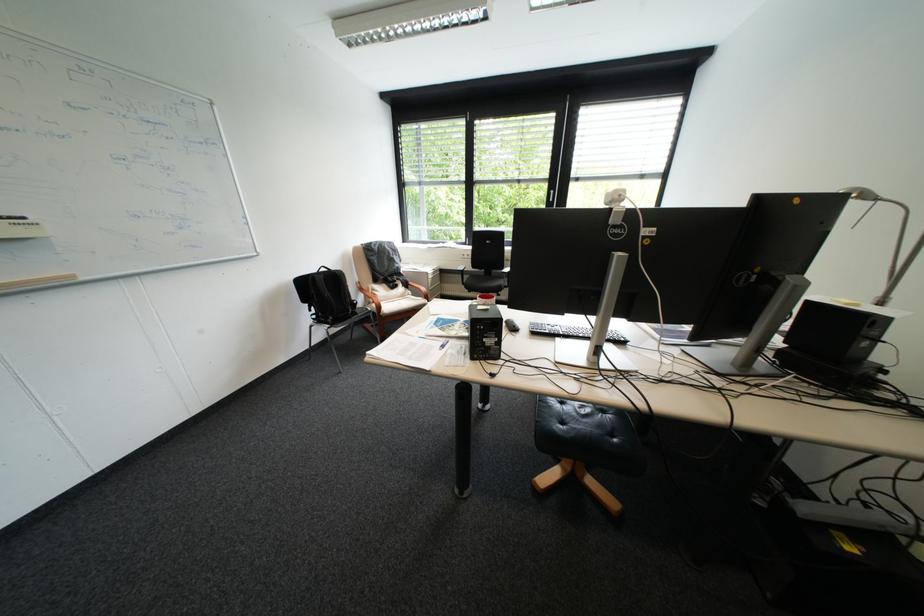
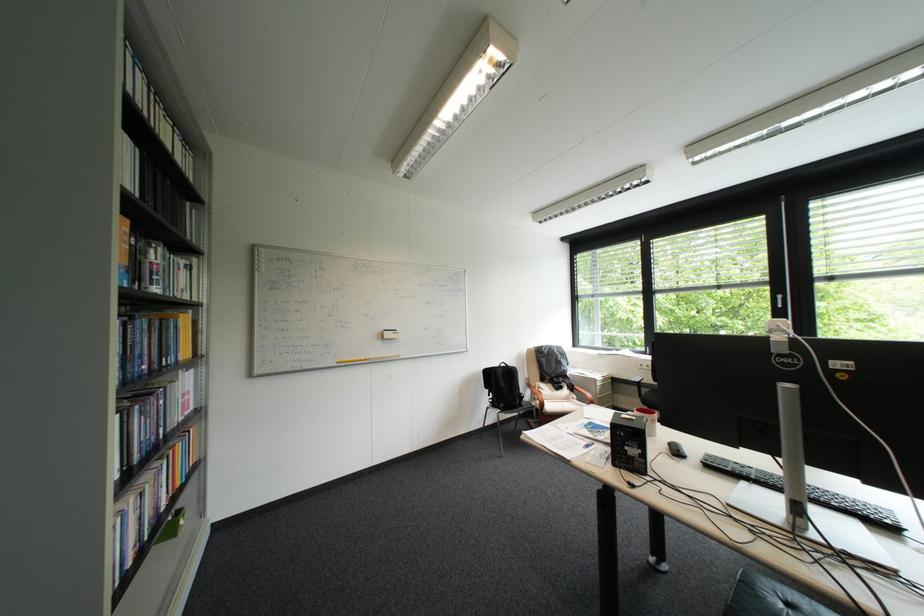
The first image is from the beginning of the video and the second image is from the end. How did the camera likely rotate when shooting the video?

The camera's rotation is toward left-up.